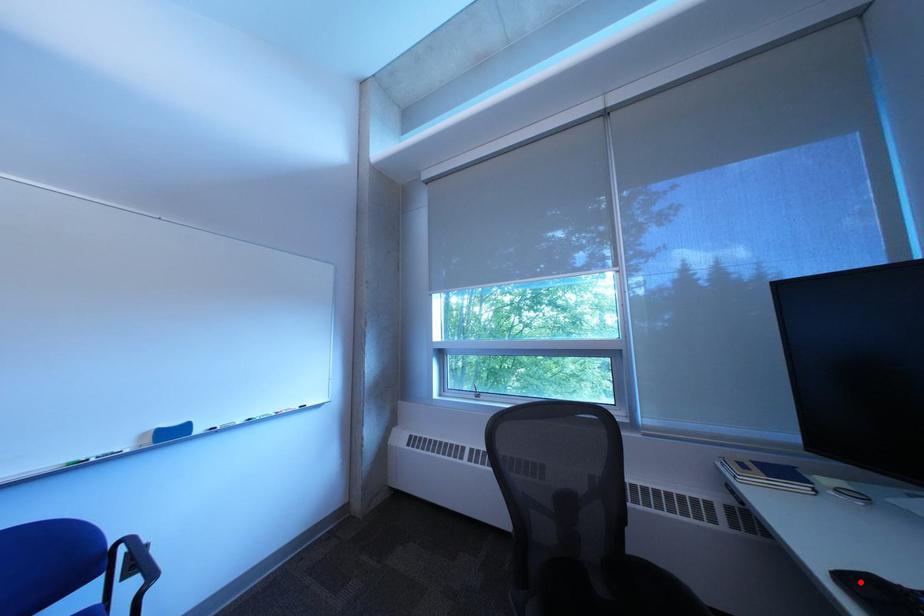
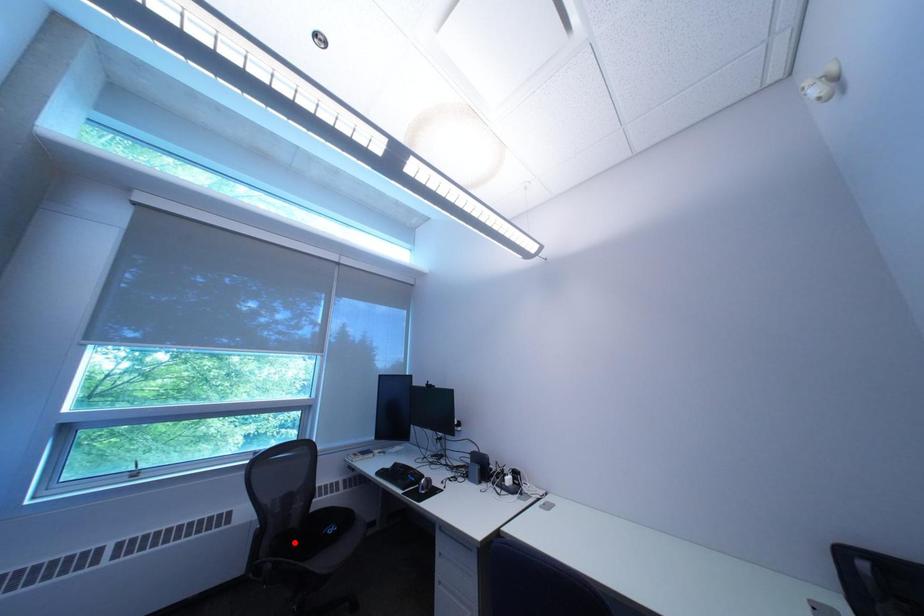
I am providing you with two images of the same scene from different viewpoints. A red point is marked on the first image and another point is marked on the second image. Is the marked point in image1 the same physical position as the marked point in image2?

No